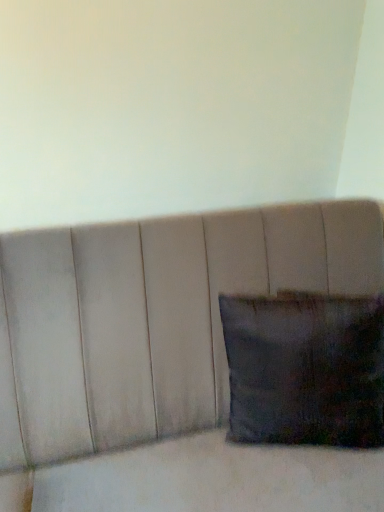
Question: Based on their positions, is dark fabric pillow at lower right located to the left or right of suede-like beige cushion at center?

Choices:
 (A) left
 (B) right

Answer: (B)

Question: From the image's perspective, is dark fabric pillow at lower right located above or below suede-like beige cushion at center?

Choices:
 (A) below
 (B) above

Answer: (B)

Question: In the image, is dark fabric pillow at lower right positioned in front of or behind suede-like beige cushion at center?

Choices:
 (A) behind
 (B) front

Answer: (A)

Question: From the image's perspective, relative to dark fabric pillow at lower right, is suede-like beige cushion at center above or below?

Choices:
 (A) below
 (B) above

Answer: (A)

Question: Does point (x=9, y=369) appear closer or farther from the camera than point (x=233, y=373)?

Choices:
 (A) farther
 (B) closer

Answer: (B)

Question: Looking at their shapes, would you say suede-like beige cushion at center is wider or thinner than dark fabric pillow at lower right?

Choices:
 (A) wide
 (B) thin

Answer: (A)

Question: From a real-world perspective, is suede-like beige cushion at center above or below dark fabric pillow at lower right?

Choices:
 (A) above
 (B) below

Answer: (B)